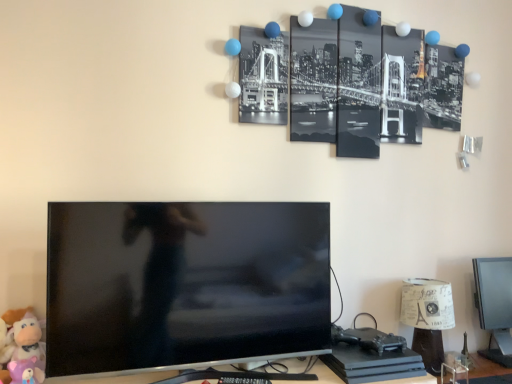
Question: Relative to soft plush toy at lower left, placed as the second toy when sorted from front to back, is plush purple bear at lower left, which ranks as the 2th toy in back-to-front order, in front or behind?

Choices:
 (A) behind
 (B) front

Answer: (B)

Question: From a real-world perspective, is plush purple bear at lower left, which ranks as the 2th toy in back-to-front order, positioned above or below soft plush toy at lower left, placed as the first toy when sorted from back to front?

Choices:
 (A) below
 (B) above

Answer: (A)

Question: Based on their relative distances, which object is nearer to the black glossy tv at center?

Choices:
 (A) matte black monitor at lower right
 (B) plush purple bear at lower left, which ranks as the 2th toy in back-to-front order
 (C) soft plush toy at lower left, placed as the second toy when sorted from front to back
 (D) paper lampshade at lower right

Answer: (C)

Question: Estimate the real-world distances between objects in this image. Which object is closer to the matte black monitor at lower right?

Choices:
 (A) paper lampshade at lower right
 (B) plush purple bear at lower left, which ranks as the 2th toy in back-to-front order
 (C) black glossy tv at center
 (D) soft plush toy at lower left, placed as the first toy when sorted from back to front

Answer: (A)